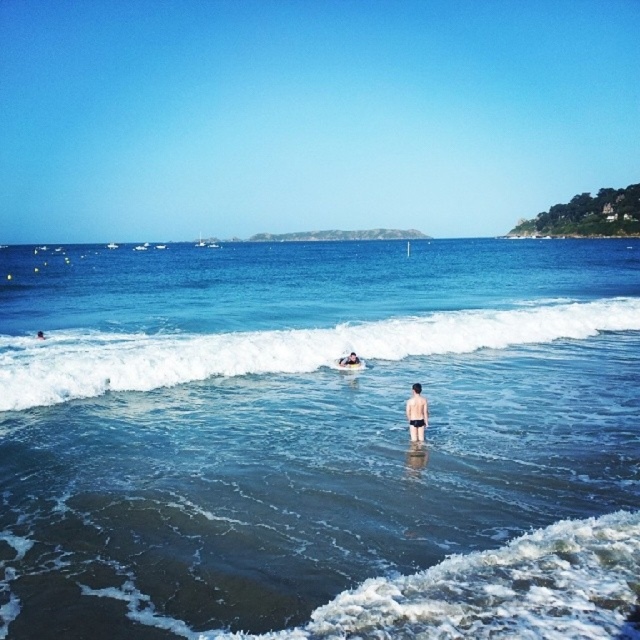
Does blue clear water at center have a lesser width compared to smooth skin person at center?

No.

Does blue clear water at center appear on the left side of smooth skin person at center?

In fact, blue clear water at center is to the right of smooth skin person at center.

Who is more distant from viewer, (132, 483) or (340, 358)?

The point (340, 358) is more distant.

At what (x,y) coordinates should I click in order to perform the action: click on blue clear water at center. Please return your answer as a coordinate pair (x, y). The image size is (640, 640). Looking at the image, I should click on (320, 442).

Based on the photo, measure the distance between point (260, 596) and camera.

Point (260, 596) is 38.81 feet from camera.

Is point (173, 388) in front of point (42, 339)?

Yes.

This screenshot has width=640, height=640. Find the location of `blue clear water at center`. blue clear water at center is located at coordinates [320, 442].

Does point (422, 380) come closer to viewer compared to point (355, 353)?

Yes, it is.

Between white foamy wave at center and smooth skin person at center, which one has more height?

With more height is white foamy wave at center.

Locate an element on the screen. The width and height of the screenshot is (640, 640). white foamy wave at center is located at coordinates (280, 348).